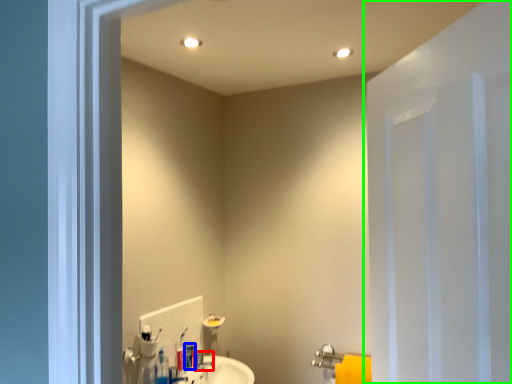
Question: Which is nearer to the plumbing fixture (highlighted by a red box)? toiletry (highlighted by a blue box) or door (highlighted by a green box).

Choices:
 (A) toiletry
 (B) door

Answer: (A)